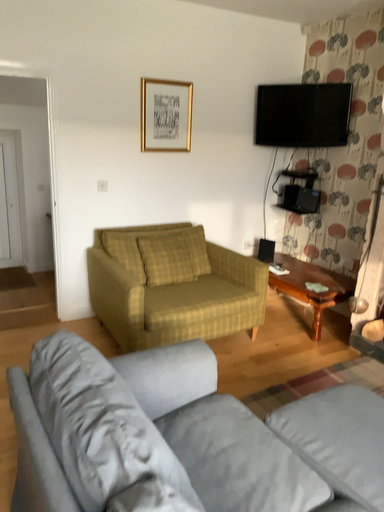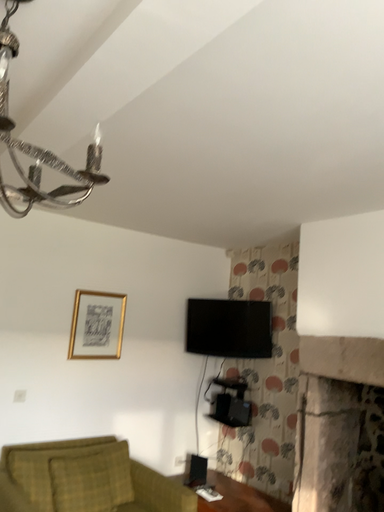
Question: How did the camera likely rotate when shooting the video?

Choices:
 (A) rotated downward
 (B) rotated upward

Answer: (B)